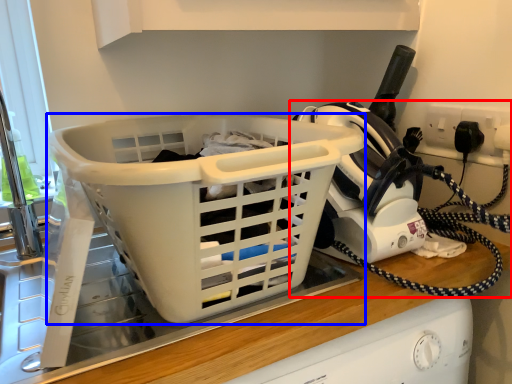
Question: Which object appears closest to the camera in this image, home appliance (highlighted by a red box) or basket (highlighted by a blue box)?

Choices:
 (A) home appliance
 (B) basket

Answer: (B)